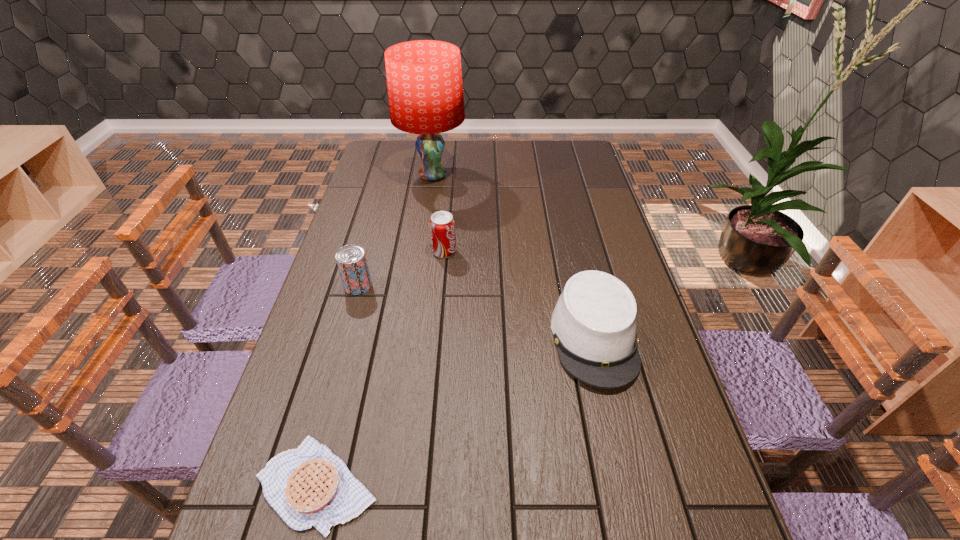
Where is `vacant space at the far right corner of the desktop`? vacant space at the far right corner of the desktop is located at coordinates (549, 146).

You are a GUI agent. You are given a task and a screenshot of the screen. Output one action in this format:
    pyautogui.click(x=<x>, y=<y>)
    Task: Click on the free area in between the farthest object and the beer can
    This screenshot has width=960, height=540.
    Given the screenshot: What is the action you would take?
    pyautogui.click(x=396, y=231)

This screenshot has width=960, height=540. Find the location of `vacant area between the beer can and the pie`. vacant area between the beer can and the pie is located at coordinates (338, 385).

This screenshot has width=960, height=540. Find the location of `free space between the pie and the beer can`. free space between the pie and the beer can is located at coordinates (338, 385).

Find the location of a particular element. free space between the beer can and the lampshade is located at coordinates (396, 231).

The width and height of the screenshot is (960, 540). In order to click on vacant space that's between the shortest object and the hat in this screenshot , I will do `click(456, 411)`.

The width and height of the screenshot is (960, 540). Find the location of `empty space that is in between the shortest object and the beer can`. empty space that is in between the shortest object and the beer can is located at coordinates (338, 385).

The width and height of the screenshot is (960, 540). Identify the location of free space between the beer can and the soda can. (401, 269).

The height and width of the screenshot is (540, 960). I want to click on unoccupied position between the nearest object and the rightmost object, so click(456, 411).

Identify the location of object that is the third closest to the second farthest object. (594, 326).